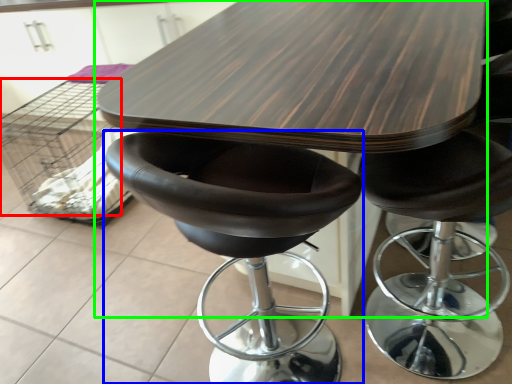
Question: Considering the real-world distances, which object is closest to crate (highlighted by a red box)? chair (highlighted by a blue box) or table (highlighted by a green box).

Choices:
 (A) chair
 (B) table

Answer: (B)